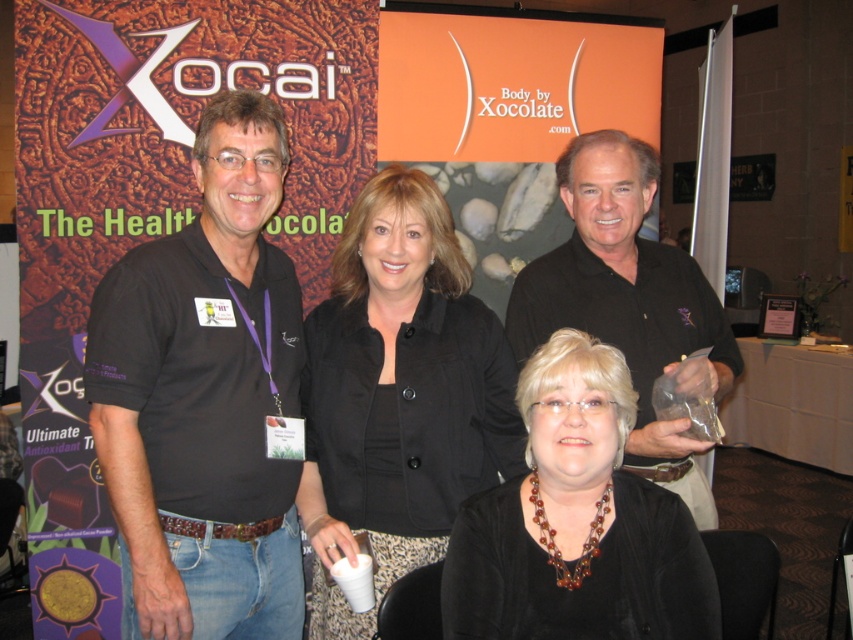
Which is more to the right, black fabric jacket at center or black velvet blouse at center?

From the viewer's perspective, black velvet blouse at center appears more on the right side.

Find the location of a particular element. The image size is (853, 640). black fabric jacket at center is located at coordinates (398, 394).

In order to click on black fabric jacket at center in this screenshot , I will do `click(398, 394)`.

Is the position of black shirt at left less distant than that of black velvet blouse at center?

No, it is not.

Which is behind, point (120, 371) or point (643, 600)?

The point (120, 371) is behind.

Locate an element on the screen. The height and width of the screenshot is (640, 853). black shirt at left is located at coordinates (204, 397).

Where is `black shirt at left`? black shirt at left is located at coordinates [x=204, y=397].

Does black shirt at left appear on the right side of black fabric jacket at center?

In fact, black shirt at left is to the left of black fabric jacket at center.

Who is more forward, (236, 595) or (466, 266)?

Positioned in front is point (236, 595).

What are the coordinates of `black shirt at left` in the screenshot? It's located at (204, 397).